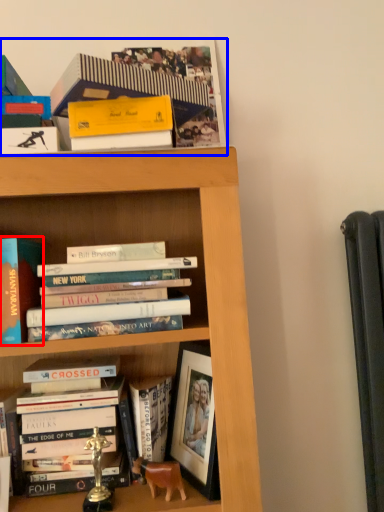
Question: Which object is closer to the camera taking this photo, book (highlighted by a red box) or book (highlighted by a blue box)?

Choices:
 (A) book
 (B) book

Answer: (B)